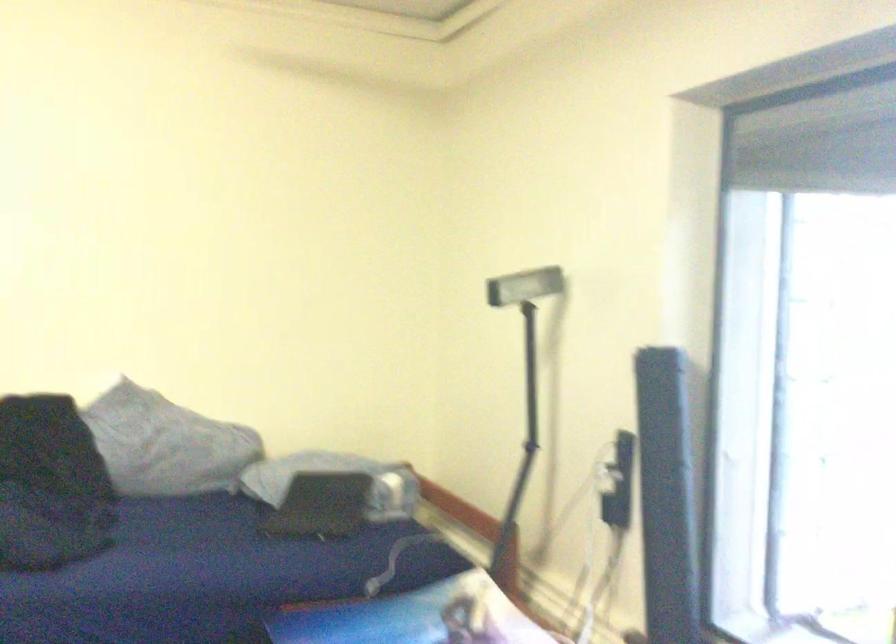
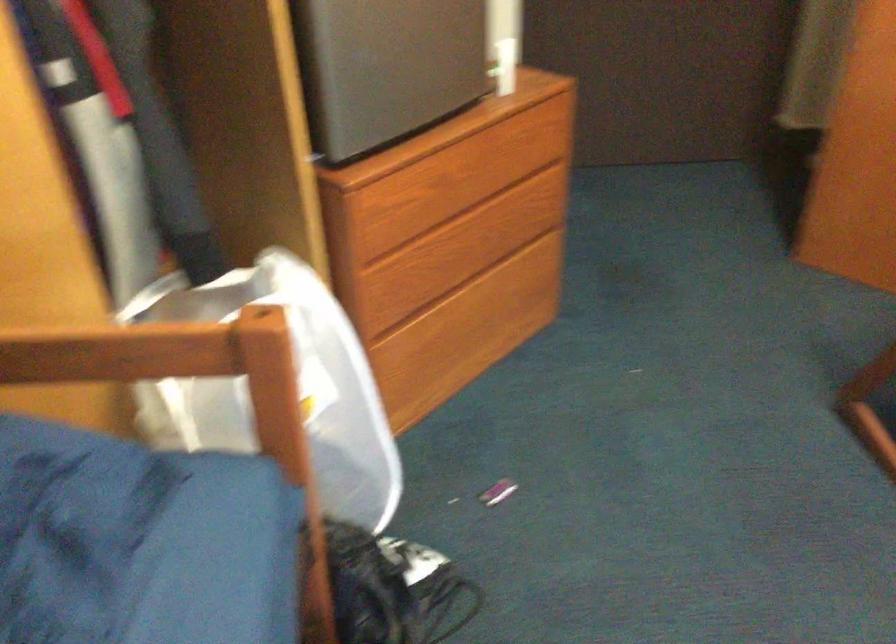
Based on the continuous images, in which direction is the camera rotating?

The rotation direction of the camera is left-down.